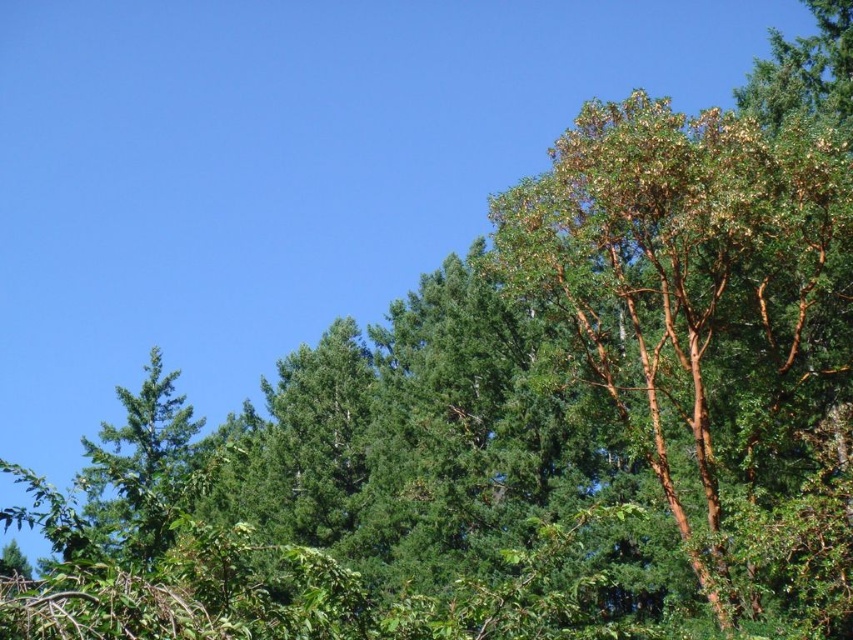
Question: Which of the following is the closest to the observer?

Choices:
 (A) click(x=175, y=376)
 (B) click(x=547, y=220)

Answer: (B)

Question: Does brown/scaly bark tree at right come in front of green matte tree at left?

Choices:
 (A) yes
 (B) no

Answer: (B)

Question: Among these objects, which one is farthest from the camera?

Choices:
 (A) green matte tree at left
 (B) brown/scaly bark tree at right

Answer: (B)

Question: Can you confirm if brown/scaly bark tree at right is positioned above green matte tree at left?

Choices:
 (A) yes
 (B) no

Answer: (A)

Question: Is brown/scaly bark tree at right behind green matte tree at left?

Choices:
 (A) no
 (B) yes

Answer: (B)